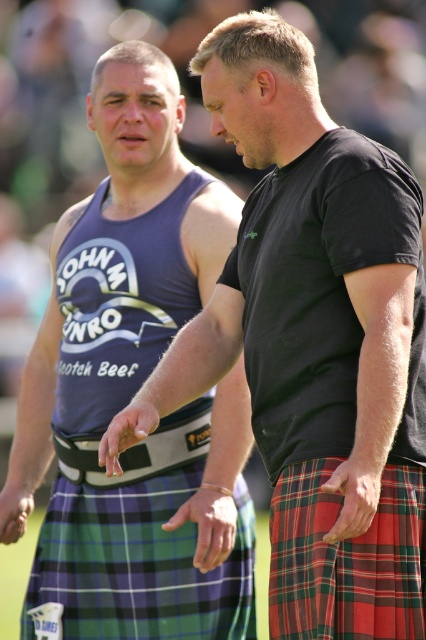
Describe the element at coordinates (140, 564) in the screenshot. The width and height of the screenshot is (426, 640). I see `green plaid kilt at center` at that location.

Who is positioned more to the left, green plaid kilt at center or red plaid kilt at center?

green plaid kilt at center is more to the left.

Locate an element on the screen. The width and height of the screenshot is (426, 640). green plaid kilt at center is located at coordinates (140, 564).

In order to click on green plaid kilt at center in this screenshot , I will do `click(140, 564)`.

Does matte black tank top at left have a greater height compared to red plaid kilt at center?

Yes, matte black tank top at left is taller than red plaid kilt at center.

Who is more forward, (x=92, y=317) or (x=287, y=593)?

Point (x=287, y=593) is in front.

The width and height of the screenshot is (426, 640). I want to click on matte black tank top at left, so click(134, 390).

Who is taller, matte black tank top at left or green plaid kilt at center?

matte black tank top at left

Is point (25, 484) in front of point (252, 602)?

No, it is behind (252, 602).

At what (x,y) coordinates should I click in order to perform the action: click on matte black tank top at left. Please return your answer as a coordinate pair (x, y). The height and width of the screenshot is (640, 426). Looking at the image, I should click on (134, 390).